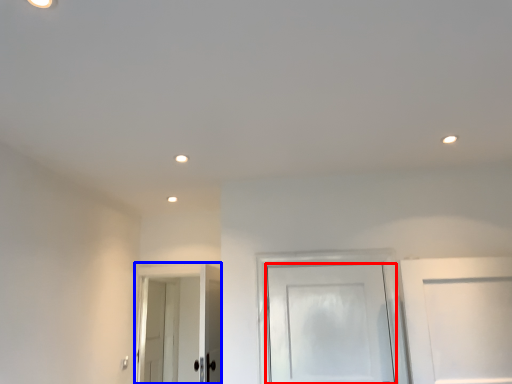
Question: Which object is further to the camera taking this photo, door (highlighted by a red box) or door (highlighted by a blue box)?

Choices:
 (A) door
 (B) door

Answer: (B)